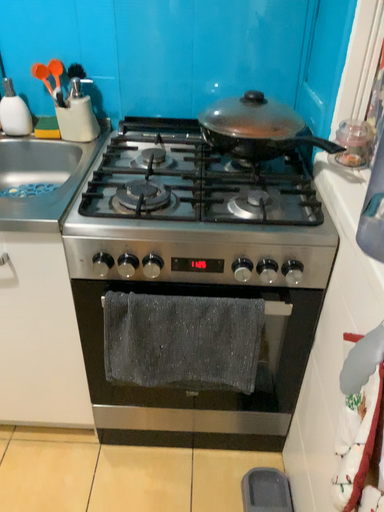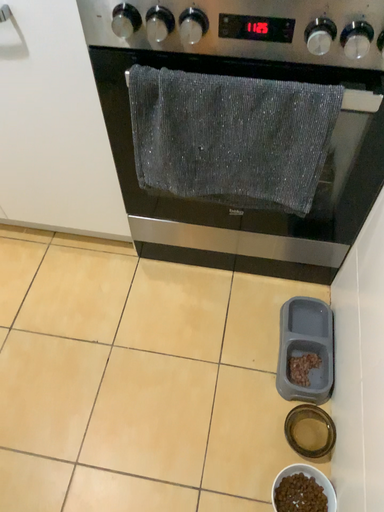
Question: How did the camera likely rotate when shooting the video?

Choices:
 (A) rotated right
 (B) rotated left

Answer: (B)